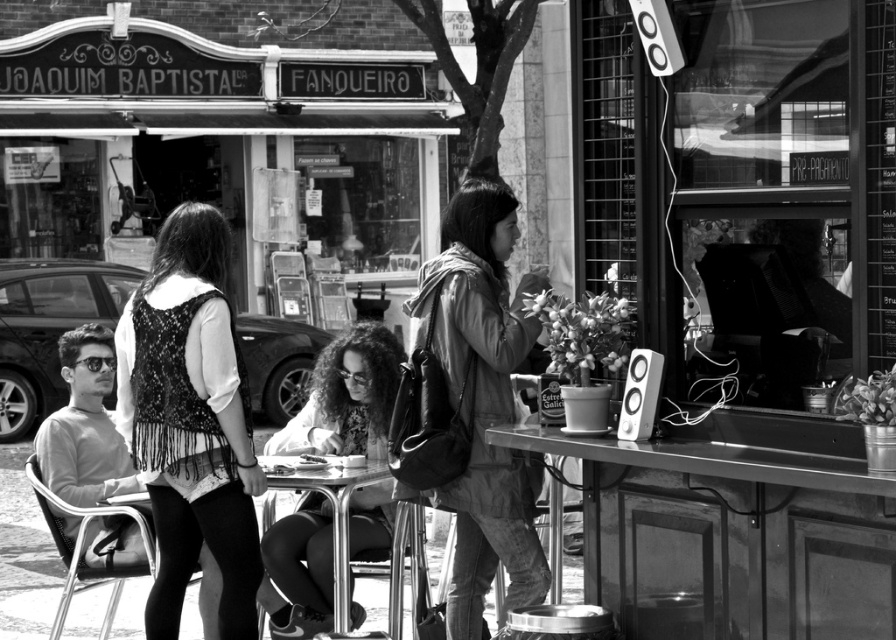
Is the position of smooth gray sweater at left more distant than that of metallic silver table at center?

That is True.

Which of these two, smooth gray sweater at left or metallic silver table at center, stands shorter?

metallic silver table at center is shorter.

What do you see at coordinates (85, 426) in the screenshot? The width and height of the screenshot is (896, 640). I see `smooth gray sweater at left` at bounding box center [85, 426].

The width and height of the screenshot is (896, 640). What are the coordinates of `smooth gray sweater at left` in the screenshot? It's located at 85,426.

Does point (497, 420) come in front of point (365, 477)?

Yes, point (497, 420) is in front of point (365, 477).

Locate an element on the screen. The width and height of the screenshot is (896, 640). leather jacket at center is located at coordinates (483, 397).

Does fringed fabric vest at center lie in front of smooth gray sweater at left?

Yes, fringed fabric vest at center is closer to the viewer.

What are the coordinates of `fringed fabric vest at center` in the screenshot? It's located at (191, 420).